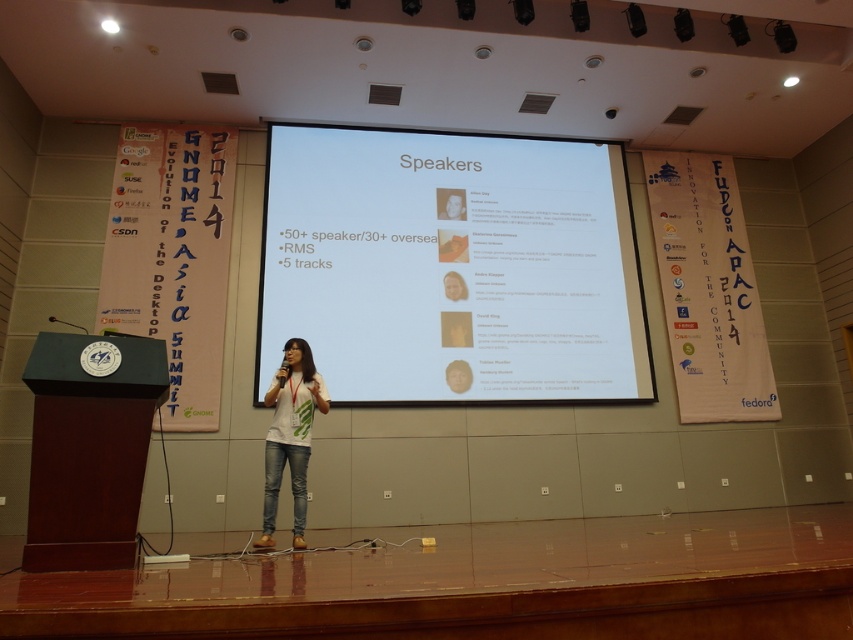
Question: Which point appears closest to the camera in this image?

Choices:
 (A) (309, 378)
 (B) (135, 452)
 (C) (492, 234)

Answer: (B)

Question: Is white glossy projector screen at center positioned in front of white matte t-shirt at center?

Choices:
 (A) yes
 (B) no

Answer: (B)

Question: Considering the real-world distances, which object is closest to the white glossy projector screen at center?

Choices:
 (A) dark wood podium at left
 (B) white matte t-shirt at center

Answer: (B)

Question: Among these points, which one is farthest from the camera?

Choices:
 (A) 587,371
 (B) 61,355
 (C) 296,547

Answer: (A)

Question: Is white glossy projector screen at center in front of white matte t-shirt at center?

Choices:
 (A) yes
 (B) no

Answer: (B)

Question: Is dark wood podium at left wider than white matte t-shirt at center?

Choices:
 (A) yes
 (B) no

Answer: (A)